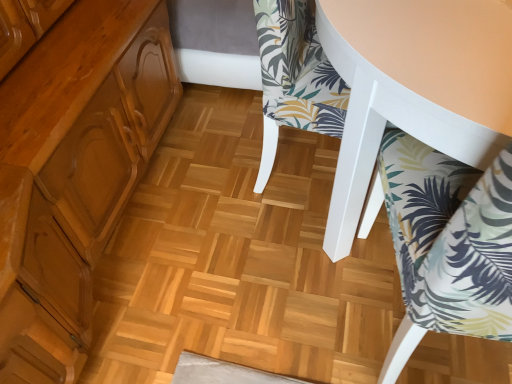
Question: Is point (357, 21) positioned closer to the camera than point (443, 291)?

Choices:
 (A) farther
 (B) closer

Answer: (A)

Question: In the image, is white fabric chair at upper right, the 1th chair viewed from the top, on the left side or the right side of printed fabric chair at lower right, which ranks as the 1th chair in bottom-to-top order?

Choices:
 (A) right
 (B) left

Answer: (B)

Question: Is white fabric chair at upper right, which is counted as the second chair, starting from the bottom, wider or thinner than printed fabric chair at lower right, which appears as the 2th chair when viewed from the top?

Choices:
 (A) wide
 (B) thin

Answer: (A)

Question: From the image's perspective, is printed fabric chair at lower right, which ranks as the 1th chair in bottom-to-top order, positioned above or below white fabric chair at upper right, the 1th chair viewed from the top?

Choices:
 (A) below
 (B) above

Answer: (A)

Question: Which is correct: printed fabric chair at lower right, which appears as the 2th chair when viewed from the top, is inside white fabric chair at upper right, which is counted as the second chair, starting from the bottom, or outside of it?

Choices:
 (A) outside
 (B) inside

Answer: (A)

Question: Is printed fabric chair at lower right, which ranks as the 1th chair in bottom-to-top order, taller or shorter than white fabric chair at upper right, the 1th chair viewed from the top?

Choices:
 (A) short
 (B) tall

Answer: (B)

Question: Is point (402, 157) positioned closer to the camera than point (368, 119)?

Choices:
 (A) closer
 (B) farther

Answer: (B)